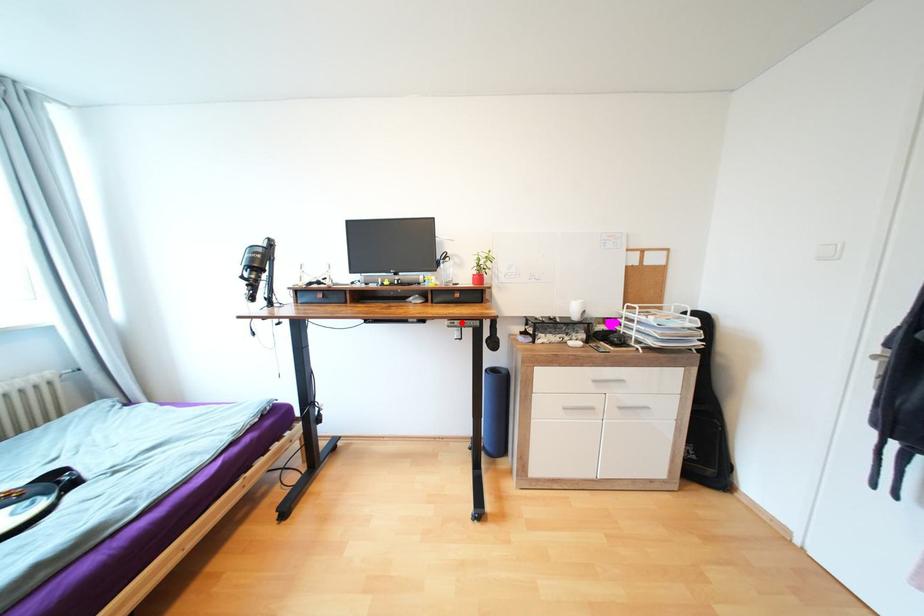
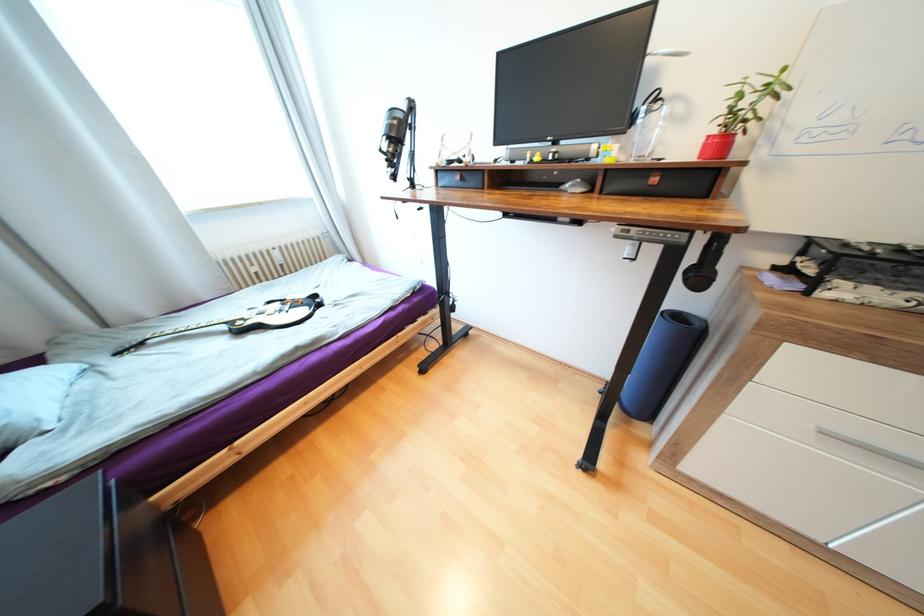
Where in the second image is the point corresponding to the highlighted location from the first image?

(639, 230)